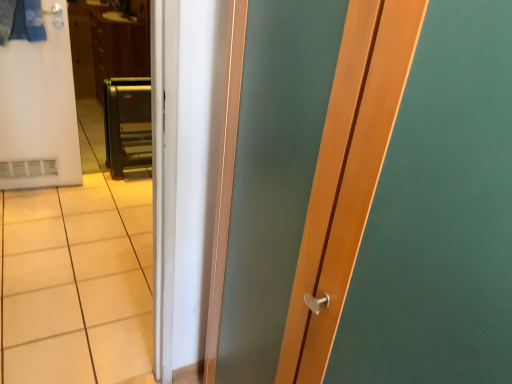
Question: Choose the correct answer: Is brown wood dresser at upper left inside white matte refrigerator at left or outside it?

Choices:
 (A) outside
 (B) inside

Answer: (A)

Question: From a real-world perspective, is brown wood dresser at upper left physically located above or below white matte refrigerator at left?

Choices:
 (A) above
 (B) below

Answer: (B)

Question: Based on their relative distances, which object is nearer to the metallic gray step ladder at center?

Choices:
 (A) white matte refrigerator at left
 (B) brown wood dresser at upper left

Answer: (B)

Question: Which is farther from the brown wood dresser at upper left?

Choices:
 (A) metallic gray step ladder at center
 (B) white matte refrigerator at left

Answer: (B)